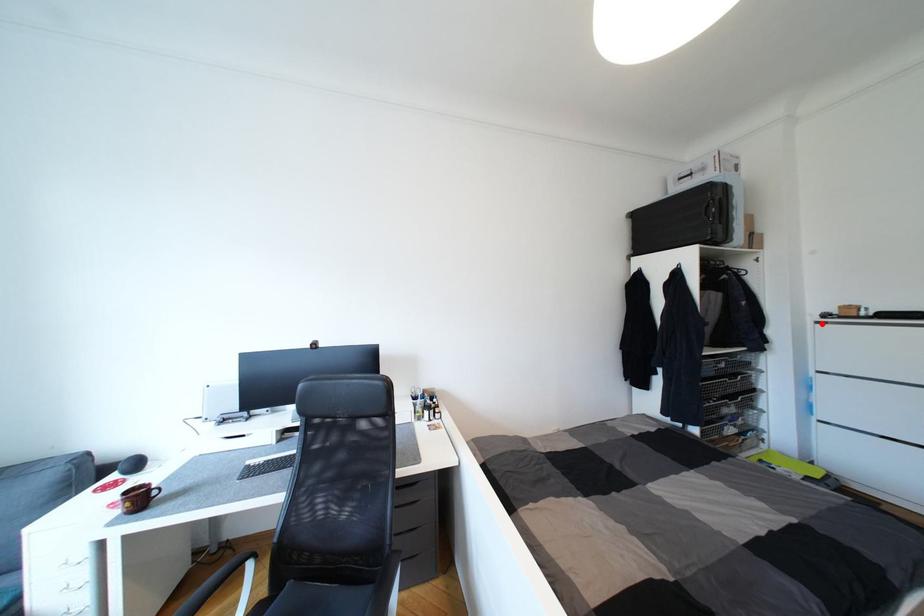
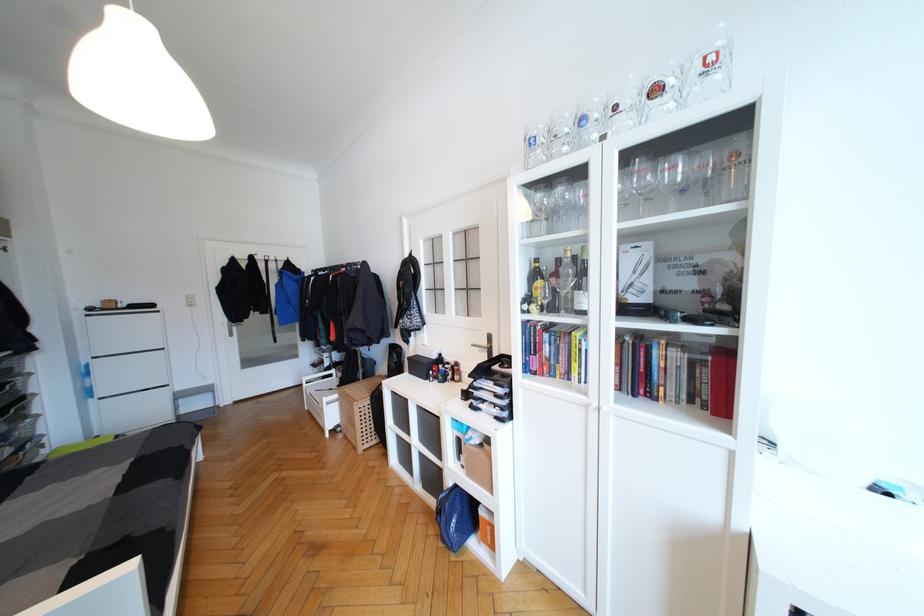
Question: I am providing you with two images of the same scene from different viewpoints. A red point is shown in image1. For the corresponding object point in image2, is it positioned nearer or farther from the camera?

Choices:
 (A) Nearer
 (B) Farther

Answer: (A)